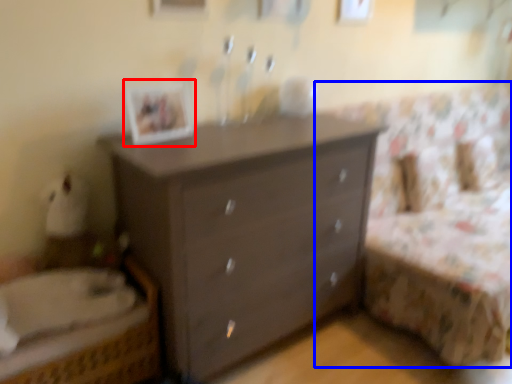
Question: Which object appears farthest to the camera in this image, picture frame (highlighted by a red box) or bed frame (highlighted by a blue box)?

Choices:
 (A) picture frame
 (B) bed frame

Answer: (A)